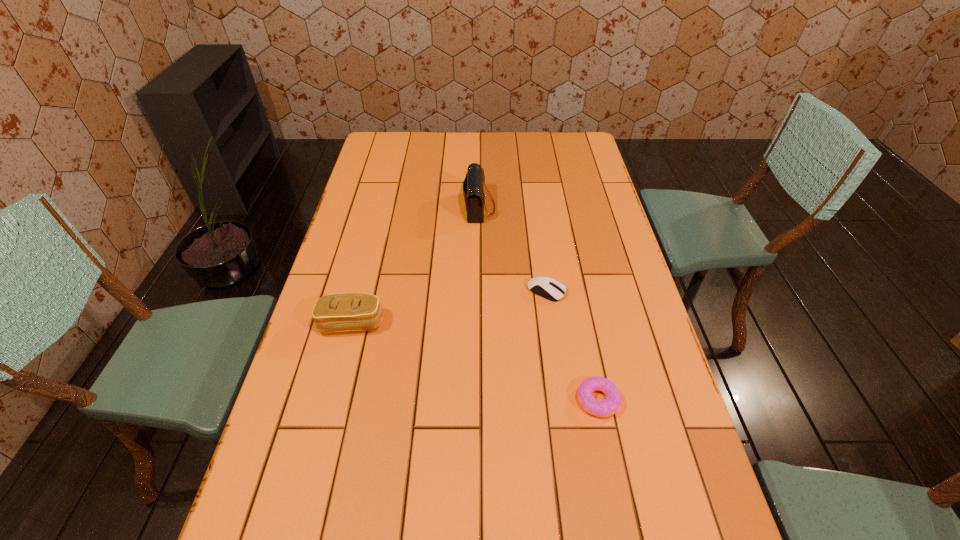
At what (x,y) coordinates should I click in order to perform the action: click on the tallest object. Please return your answer as a coordinate pair (x, y). Image resolution: width=960 pixels, height=540 pixels. Looking at the image, I should click on (473, 191).

Locate an element on the screen. the farther clutch bag is located at coordinates (473, 191).

Identify the location of the second tallest object. (339, 312).

The height and width of the screenshot is (540, 960). In order to click on the left clutch bag in this screenshot , I will do click(x=339, y=312).

The image size is (960, 540). Identify the location of the third nearest object. (549, 288).

The image size is (960, 540). I want to click on doughnut, so click(605, 408).

Locate an element on the screen. This screenshot has height=540, width=960. free spot located 0.400m on the front flap of the farthest object is located at coordinates (608, 207).

Locate an element on the screen. The width and height of the screenshot is (960, 540). vacant space located 0.320m on the zipper side of the shorter clutch bag is located at coordinates (318, 459).

Where is `vacant area situated on the left of the second farthest object`? The width and height of the screenshot is (960, 540). vacant area situated on the left of the second farthest object is located at coordinates (439, 291).

Locate an element on the screen. The height and width of the screenshot is (540, 960). vacant space located on the back of the doughnut is located at coordinates (578, 304).